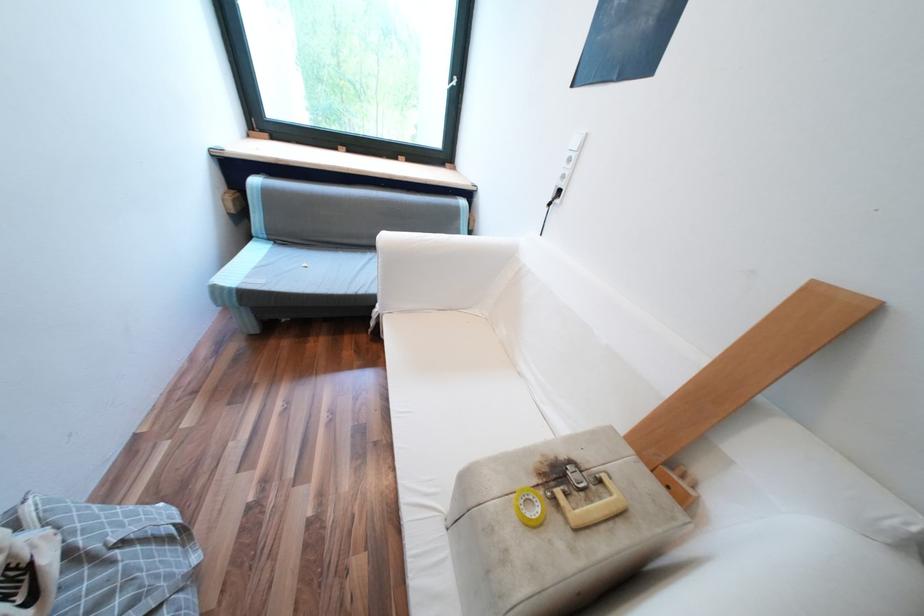
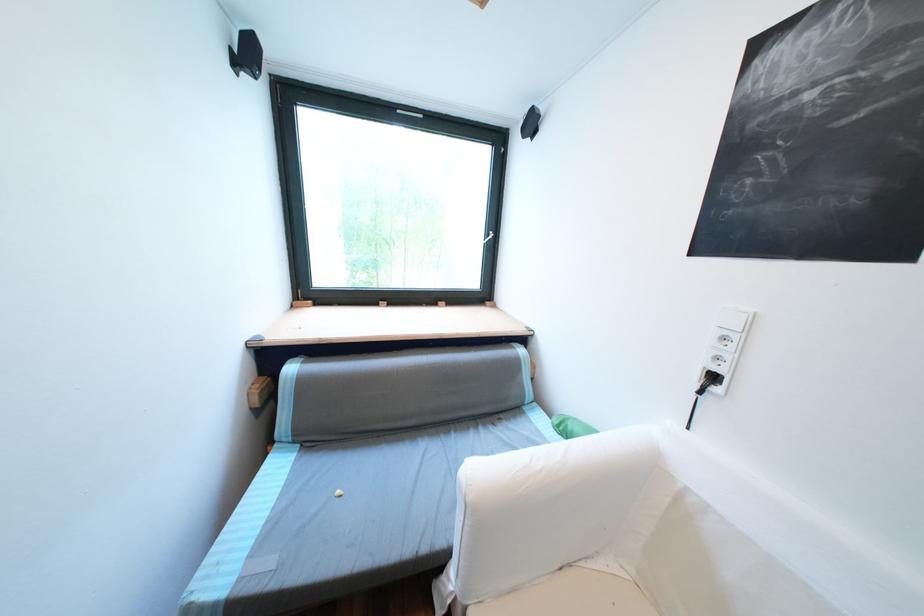
In the second image, find the point that corresponds to (371,292) in the first image.

(433, 549)